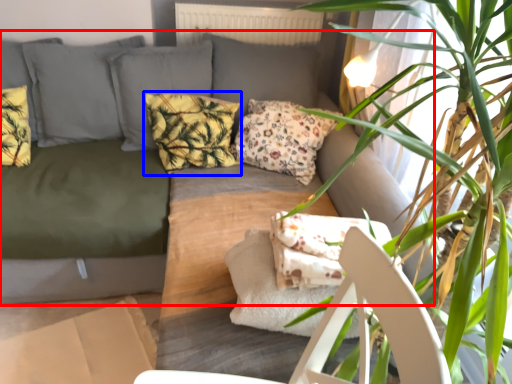
Question: Among these objects, which one is nearest to the camera, studio couch (highlighted by a red box) or pillow (highlighted by a blue box)?

Choices:
 (A) studio couch
 (B) pillow

Answer: (A)